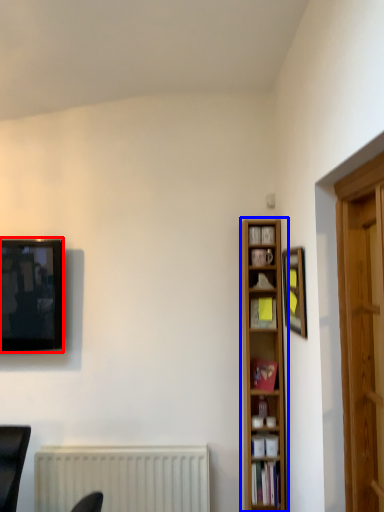
Question: Among these objects, which one is farthest to the camera, television (highlighted by a red box) or bookcase (highlighted by a blue box)?

Choices:
 (A) television
 (B) bookcase

Answer: (A)